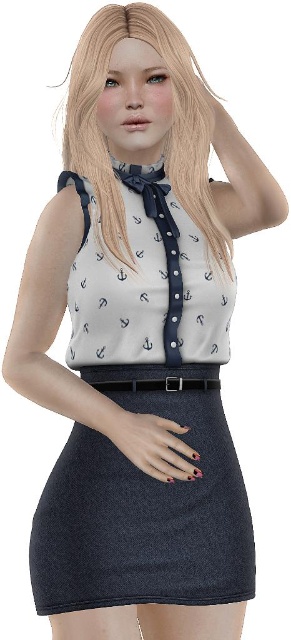
You are a fashion designer observing the outfit of a model. You need to decide where to place a new accessory between the blondehair at upper center and the black leather belt at center. Which position is higher?

The blondehair at upper center is higher than the black leather belt at center, so placing the accessory there would be higher.

Based on the scene description, where is the denim skirt at lower center located in the image?

The denim skirt at lower center is located at point (144, 518).

You are a photographer taking a portrait of the person in the image. You want to focus on the point at coordinates point [169,132]. Where exactly on the person should you aim the camera to hit that point?

The point [169,132] is located on the blonde hair at upper center, so you should aim the camera at the blonde hair at upper center to hit that point.